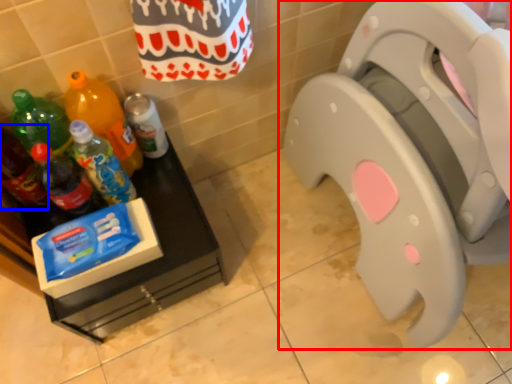
Question: Which object is closer to the camera taking this photo, toilet (highlighted by a red box) or bottle (highlighted by a blue box)?

Choices:
 (A) toilet
 (B) bottle

Answer: (A)